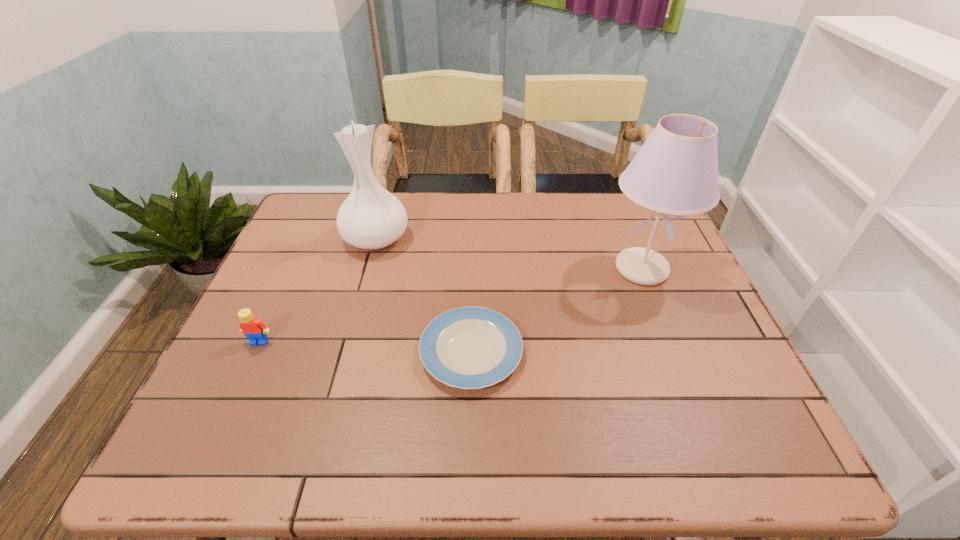
Identify the location of lampshade. Image resolution: width=960 pixels, height=540 pixels. (675, 172).

Locate an element on the screen. Image resolution: width=960 pixels, height=540 pixels. the rightmost object is located at coordinates (675, 172).

You are a GUI agent. You are given a task and a screenshot of the screen. Output one action in this format:
    pyautogui.click(x=<x>, y=<y>)
    Task: Click on the third object from right to left
    This screenshot has height=540, width=960.
    Given the screenshot: What is the action you would take?
    372,218

Find the location of a particular element. This screenshot has width=960, height=540. the third shortest object is located at coordinates (372, 218).

Identify the location of the leftmost object. (255, 330).

Where is `the third tallest object`? This screenshot has width=960, height=540. the third tallest object is located at coordinates (255, 330).

The image size is (960, 540). Identify the location of the shortest object. 471,347.

This screenshot has width=960, height=540. I want to click on plate, so click(471, 347).

The image size is (960, 540). What are the coordinates of `free space located on the back of the rightmost object` in the screenshot? It's located at (612, 194).

Identify the location of blank space located 0.240m on the right of the vase. (491, 238).